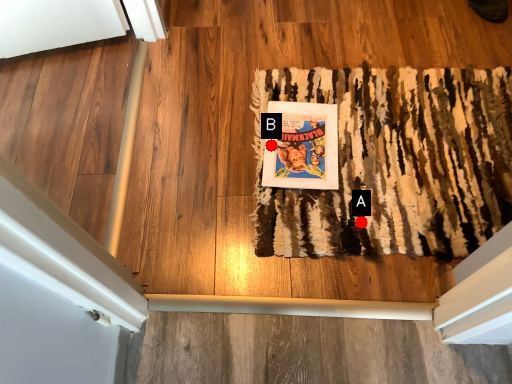
Question: Two points are circled on the image, labeled by A and B beside each circle. Among these points, which one is farthest from the camera?

Choices:
 (A) A is further
 (B) B is further

Answer: (B)